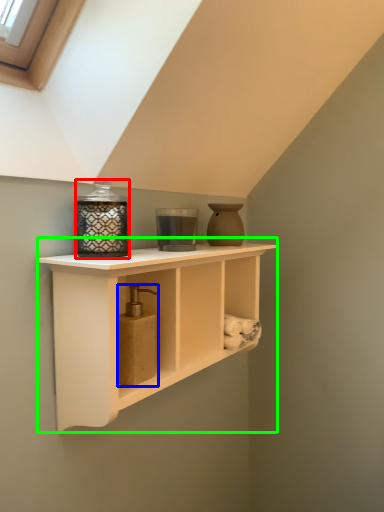
Question: Which object is positioned farthest from candle holder (highlighted by a red box)? Select from soap dispenser (highlighted by a blue box) and shelf (highlighted by a green box).

Choices:
 (A) soap dispenser
 (B) shelf

Answer: (B)